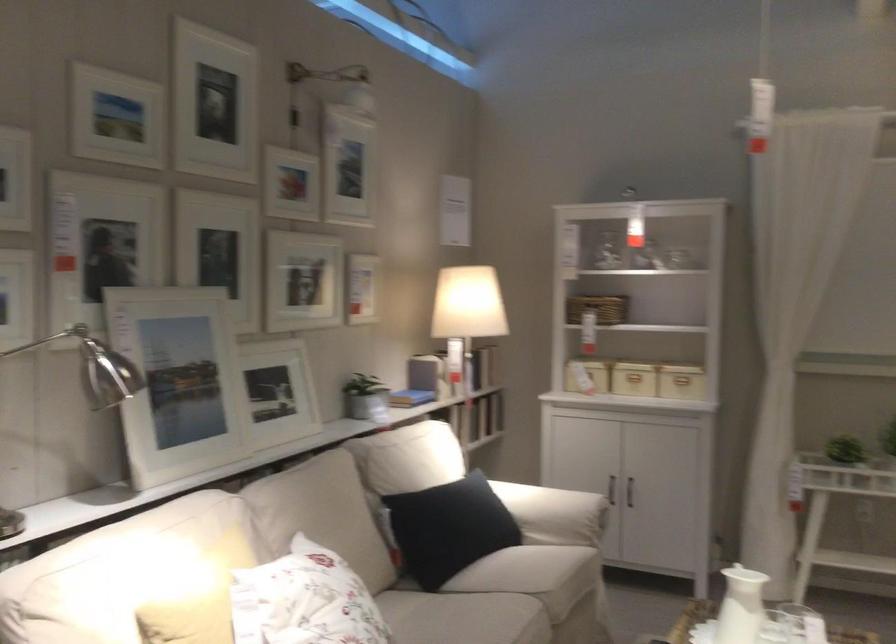
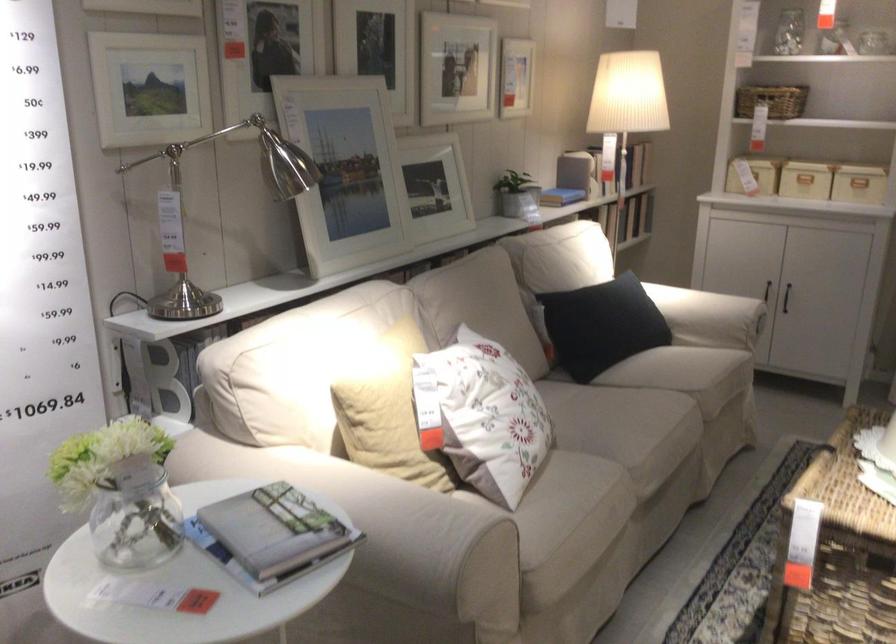
Locate, in the second image, the point that corresponds to (x=636, y=390) in the first image.

(805, 180)